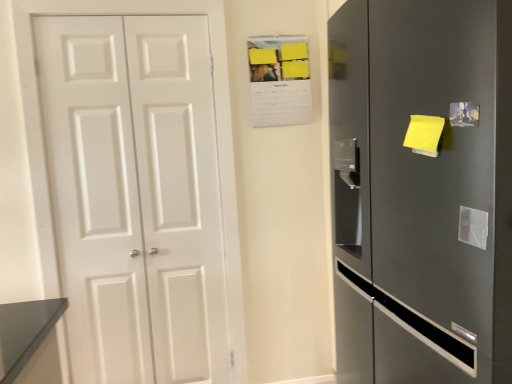
Question: From the image's perspective, relative to white matte door at left, is satin silver refrigerator at right above or below?

Choices:
 (A) above
 (B) below

Answer: (B)

Question: From a real-world perspective, is satin silver refrigerator at right positioned above or below white matte door at left?

Choices:
 (A) below
 (B) above

Answer: (A)

Question: From their relative heights in the image, would you say satin silver refrigerator at right is taller or shorter than white matte door at left?

Choices:
 (A) short
 (B) tall

Answer: (A)

Question: Considering their positions, is white matte door at left located in front of or behind satin silver refrigerator at right?

Choices:
 (A) behind
 (B) front

Answer: (A)

Question: Is white matte door at left wider or thinner than satin silver refrigerator at right?

Choices:
 (A) thin
 (B) wide

Answer: (A)

Question: From the image's perspective, is white matte door at left located above or below satin silver refrigerator at right?

Choices:
 (A) below
 (B) above

Answer: (B)

Question: Is white matte door at left to the left or to the right of satin silver refrigerator at right in the image?

Choices:
 (A) left
 (B) right

Answer: (A)